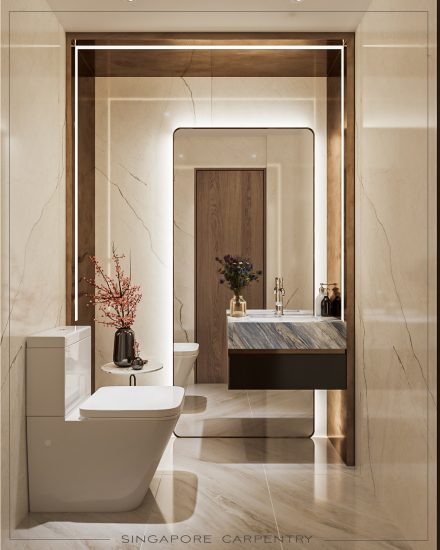
What are the coordinates of `marble like walls` in the screenshot? It's located at (409, 204), (43, 206).